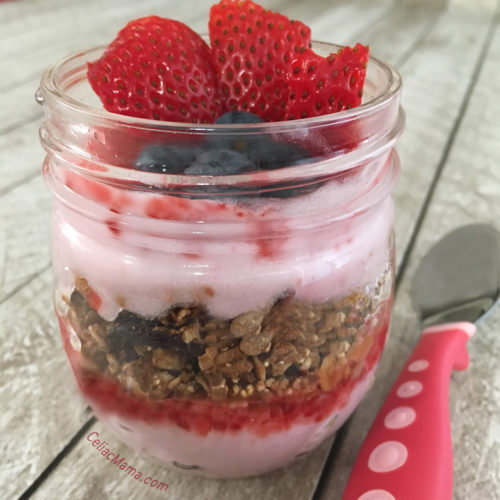
At what (x,y) coordinates should I click in order to perform the action: click on handle. Please return your answer as a coordinate pair (x, y). Looking at the image, I should click on (426, 408).